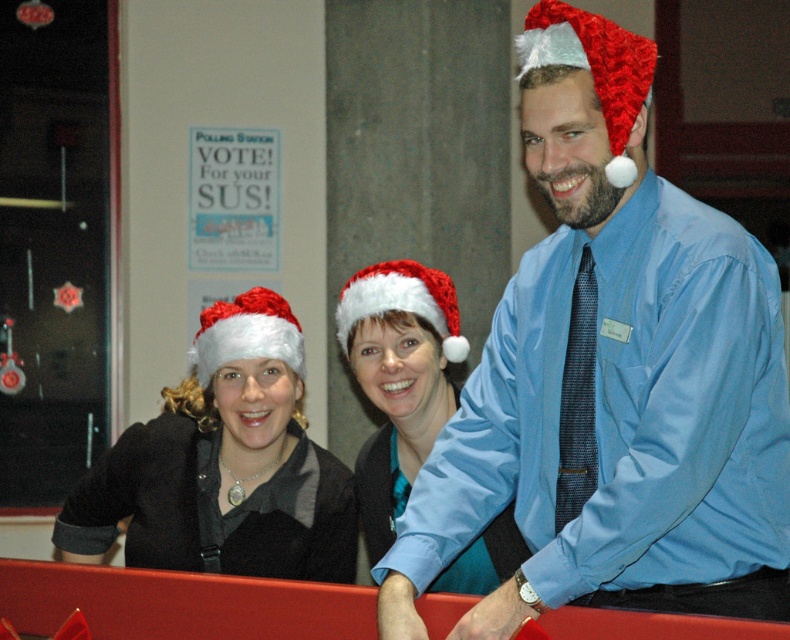
Question: Which of these objects is positioned farthest from the blue satin shirt at center?

Choices:
 (A) white fuzzy santa hat at left
 (B) white fuzzy santa hat at center
 (C) red knitted santa hat at upper right
 (D) black matte santa hat at left

Answer: (A)

Question: Can you confirm if white fuzzy santa hat at center is smaller than red knitted santa hat at upper right?

Choices:
 (A) yes
 (B) no

Answer: (B)

Question: Which is nearer to the black matte santa hat at left?

Choices:
 (A) white fuzzy santa hat at left
 (B) white fuzzy santa hat at center
 (C) blue satin shirt at center

Answer: (A)

Question: Which of these objects is positioned farthest from the white fluffy santa hat at center?

Choices:
 (A) blue satin shirt at center
 (B) black matte santa hat at left

Answer: (A)

Question: Is red knitted santa hat at upper right to the right of white fluffy santa hat at center from the viewer's perspective?

Choices:
 (A) yes
 (B) no

Answer: (A)

Question: Is black matte santa hat at left smaller than red knitted santa hat at upper right?

Choices:
 (A) yes
 (B) no

Answer: (B)